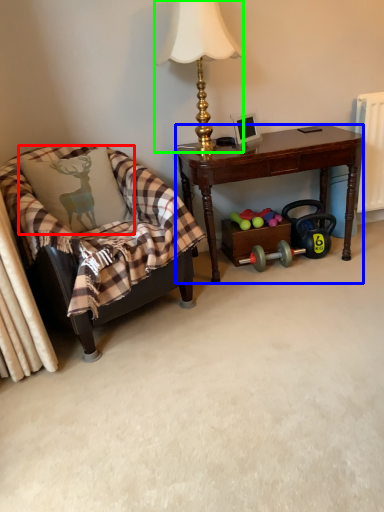
Question: Estimate the real-world distances between objects in this image. Which object is farther from pillow (highlighted by a red box), desk (highlighted by a blue box) or lamp (highlighted by a green box)?

Choices:
 (A) desk
 (B) lamp

Answer: (B)